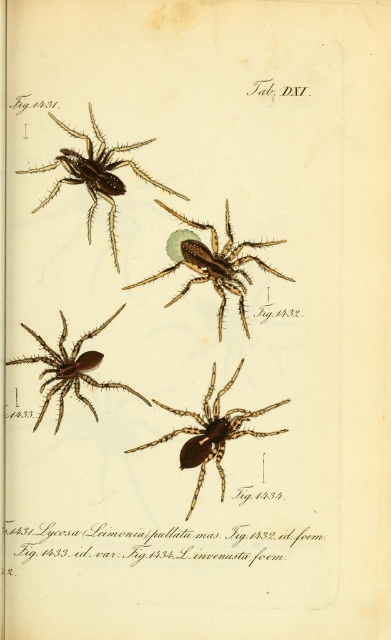
You are an entomologist examining the scientific illustration page labeled Tab. D XI. You notice two points marked on the page at coordinates point (179, 256) and point (102, 324). Based on their positions, which point is closer to the viewer?

Point (179, 256) is in front of point (102, 324), so it is closer to the viewer.

Looking at this image, you are an entomologist examining this page. You notice two spiders labeled as brown textured spider at upper left and brown matte spider at lower left. Which one is positioned to the right of the other?

The brown textured spider at upper left is positioned to the right of the brown matte spider at lower left.

You are an entomologist comparing two spiders in a scientific publication. You have a ruler and need to determine which spider illustration is wider. You see the brown textured spider at center and the brown matte spider at lower left. Which one has a greater width?

The brown textured spider at center has a greater width than the brown matte spider at lower left according to the description.